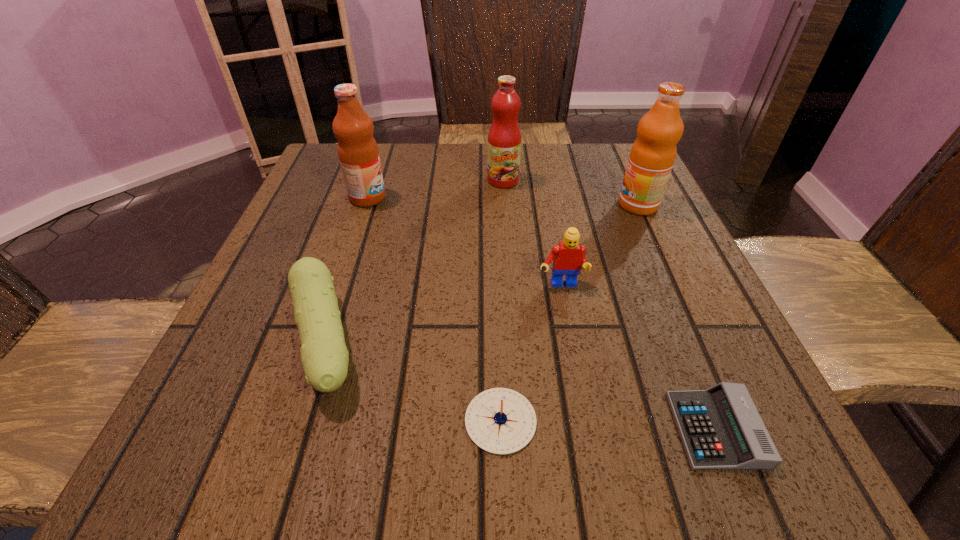
Where is `vacant space at the far right corner of the desktop`? This screenshot has height=540, width=960. vacant space at the far right corner of the desktop is located at coordinates click(x=595, y=176).

Identify the location of vacant point located between the fourth shortest object and the rightmost fruit juice. The height and width of the screenshot is (540, 960). (600, 245).

Image resolution: width=960 pixels, height=540 pixels. Find the location of `unoccupied position between the calculator and the third shortest object`. unoccupied position between the calculator and the third shortest object is located at coordinates (520, 386).

This screenshot has height=540, width=960. In order to click on vacant area that lies between the cucumber and the second fruit juice from left to right in this screenshot , I will do `click(414, 261)`.

Find the location of a particular element. Image resolution: width=960 pixels, height=540 pixels. vacant space that's between the second fruit juice from left to right and the shortest object is located at coordinates (610, 305).

You are a GUI agent. You are given a task and a screenshot of the screen. Output one action in this format:
    pyautogui.click(x=<x>, y=<y>)
    Task: Click on the unoccupied position between the rightmost fruit juice and the second shortest object
    
    Given the screenshot: What is the action you would take?
    pyautogui.click(x=569, y=313)

At what (x,y) coordinates should I click in order to perform the action: click on vacant area that lies between the second fruit juice from right to left and the rightmost fruit juice. Please return your answer as a coordinate pair (x, y). The height and width of the screenshot is (540, 960). Looking at the image, I should click on (570, 193).

You are a GUI agent. You are given a task and a screenshot of the screen. Output one action in this format:
    pyautogui.click(x=<x>, y=<y>)
    Task: Click on the free area in between the sixth tallest object and the calculator
    
    Given the screenshot: What is the action you would take?
    pyautogui.click(x=609, y=425)

Locate an element on the screen. This screenshot has height=540, width=960. free space between the rightmost fruit juice and the second shortest object is located at coordinates (569, 313).

Find the location of a particular element. Image resolution: width=960 pixels, height=540 pixels. vacant space that's between the fifth object from left to right and the rightmost fruit juice is located at coordinates (600, 245).